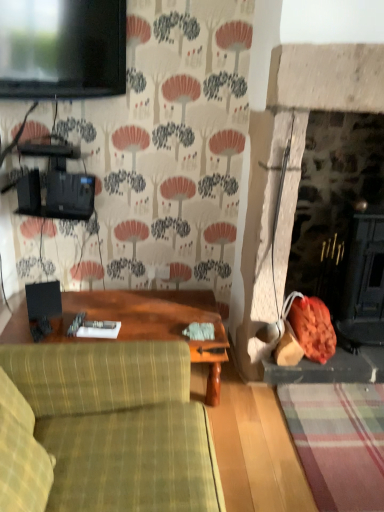
Question: Considering the relative sizes of matte black tv at upper left and wooden table at center in the image provided, is matte black tv at upper left taller than wooden table at center?

Choices:
 (A) yes
 (B) no

Answer: (A)

Question: Would you say matte black tv at upper left is a long distance from wooden table at center?

Choices:
 (A) no
 (B) yes

Answer: (B)

Question: Is matte black tv at upper left wider than wooden table at center?

Choices:
 (A) no
 (B) yes

Answer: (A)

Question: Is matte black tv at upper left positioned with its back to wooden table at center?

Choices:
 (A) yes
 (B) no

Answer: (B)

Question: Does matte black tv at upper left turn towards wooden table at center?

Choices:
 (A) yes
 (B) no

Answer: (B)

Question: Can you confirm if matte black tv at upper left is smaller than wooden table at center?

Choices:
 (A) no
 (B) yes

Answer: (B)

Question: Is matte black tv at upper left thinner than green plaid fabric couch at lower left?

Choices:
 (A) yes
 (B) no

Answer: (A)

Question: From a real-world perspective, is matte black tv at upper left over green plaid fabric couch at lower left?

Choices:
 (A) yes
 (B) no

Answer: (A)

Question: Considering the relative sizes of matte black tv at upper left and green plaid fabric couch at lower left in the image provided, is matte black tv at upper left taller than green plaid fabric couch at lower left?

Choices:
 (A) yes
 (B) no

Answer: (B)

Question: Is matte black tv at upper left shorter than green plaid fabric couch at lower left?

Choices:
 (A) yes
 (B) no

Answer: (A)

Question: From a real-world perspective, is matte black tv at upper left located beneath green plaid fabric couch at lower left?

Choices:
 (A) yes
 (B) no

Answer: (B)

Question: Does matte black tv at upper left have a greater width compared to green plaid fabric couch at lower left?

Choices:
 (A) no
 (B) yes

Answer: (A)

Question: From the image's perspective, would you say wooden table at center is positioned over matte black tv at upper left?

Choices:
 (A) yes
 (B) no

Answer: (B)